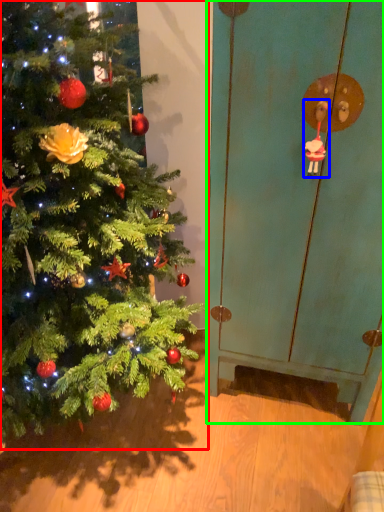
Question: Considering the real-world distances, which object is farthest from christmas tree (highlighted by a red box)? toy (highlighted by a blue box) or screen door (highlighted by a green box)?

Choices:
 (A) toy
 (B) screen door

Answer: (A)